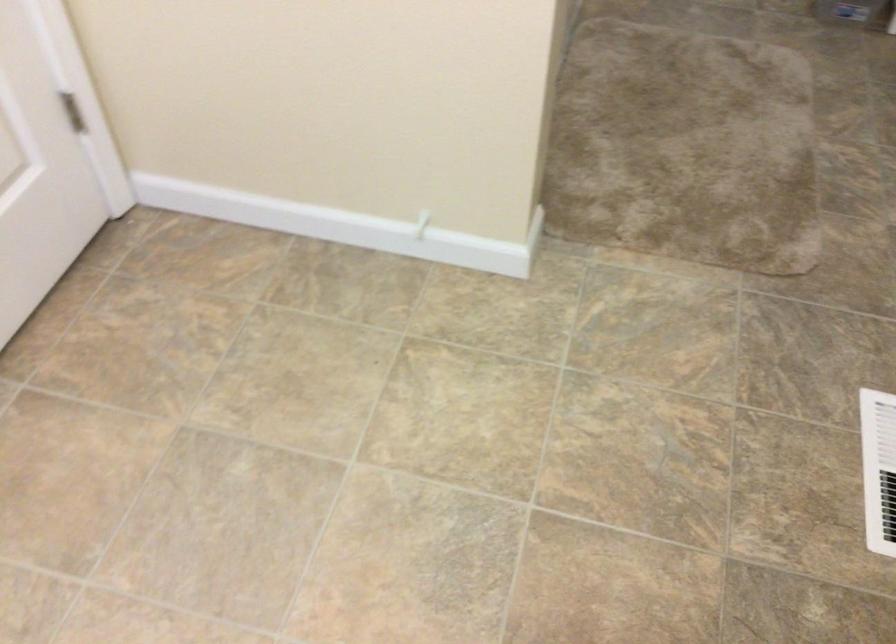
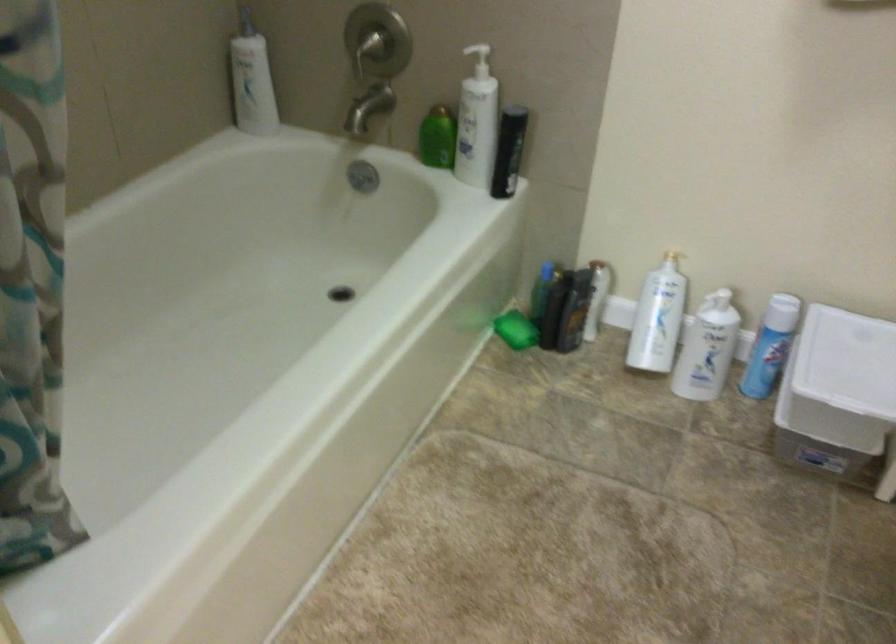
The images are taken continuously from a first-person perspective. In which direction are you moving?

The cameraman moved toward right, forward.